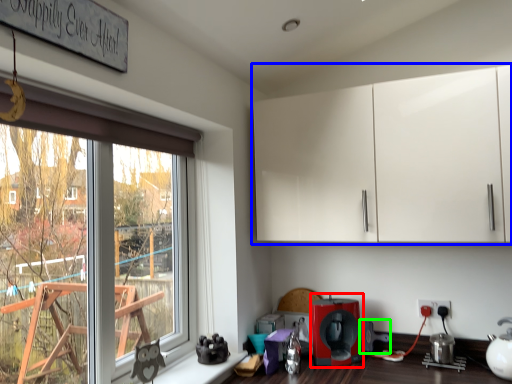
Question: Which is farther away from coffee machine (highlighted by a red box)? cabinetry (highlighted by a blue box) or coffee machine (highlighted by a green box)?

Choices:
 (A) cabinetry
 (B) coffee machine

Answer: (A)